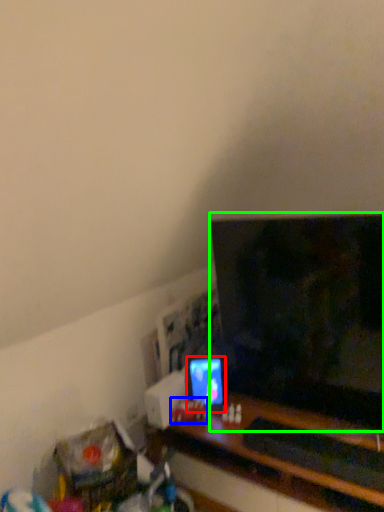
Question: Which object is the closest to the computer monitor (highlighted by a red box)? Choose among these: toy (highlighted by a blue box) or television (highlighted by a green box).

Choices:
 (A) toy
 (B) television

Answer: (A)